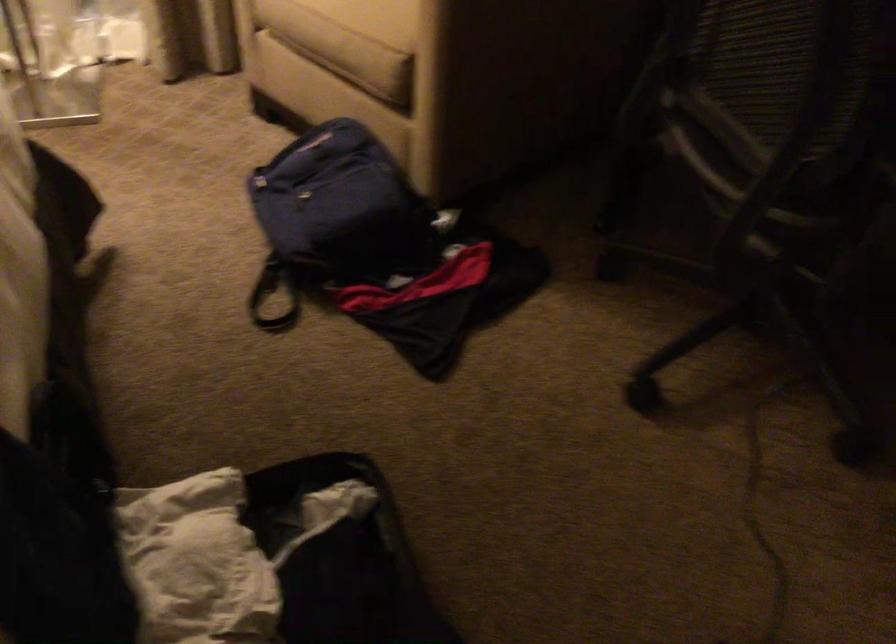
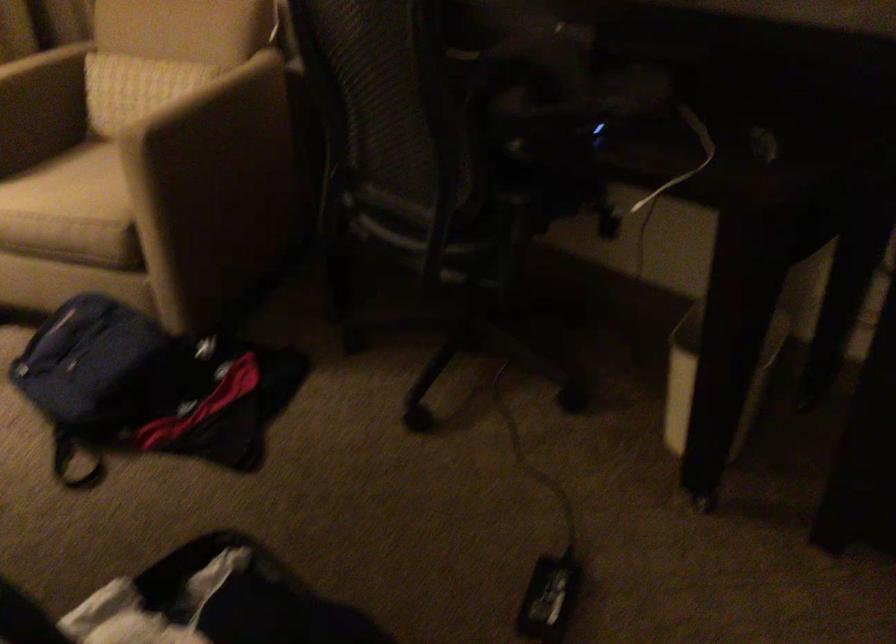
What movement of the cameraman would produce the second image?

The movement direction of the cameraman is left, backward.